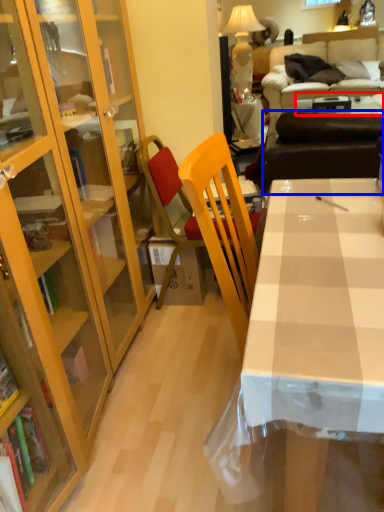
Question: Which object is further to the camera taking this photo, table (highlighted by a red box) or studio couch (highlighted by a blue box)?

Choices:
 (A) table
 (B) studio couch

Answer: (A)